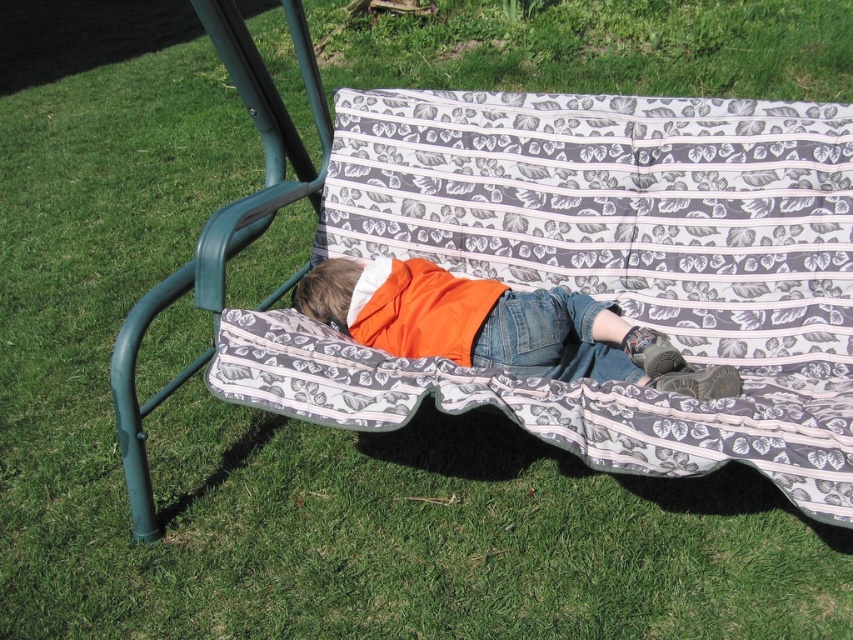
Can you confirm if patterned fabric blanket at center is bigger than orange fabric shirt at center?

Yes.

Is patterned fabric blanket at center behind orange fabric shirt at center?

No, it is not.

Does point (341, 129) come farther from viewer compared to point (543, 308)?

Yes, it is behind point (543, 308).

At what (x,y) coordinates should I click in order to perform the action: click on patterned fabric blanket at center. Please return your answer as a coordinate pair (x, y). Looking at the image, I should click on (614, 266).